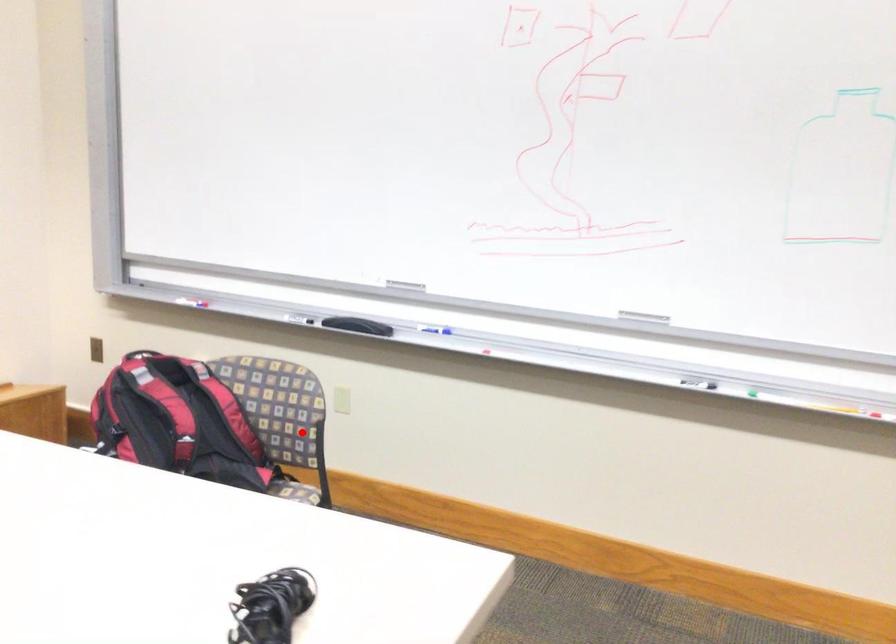
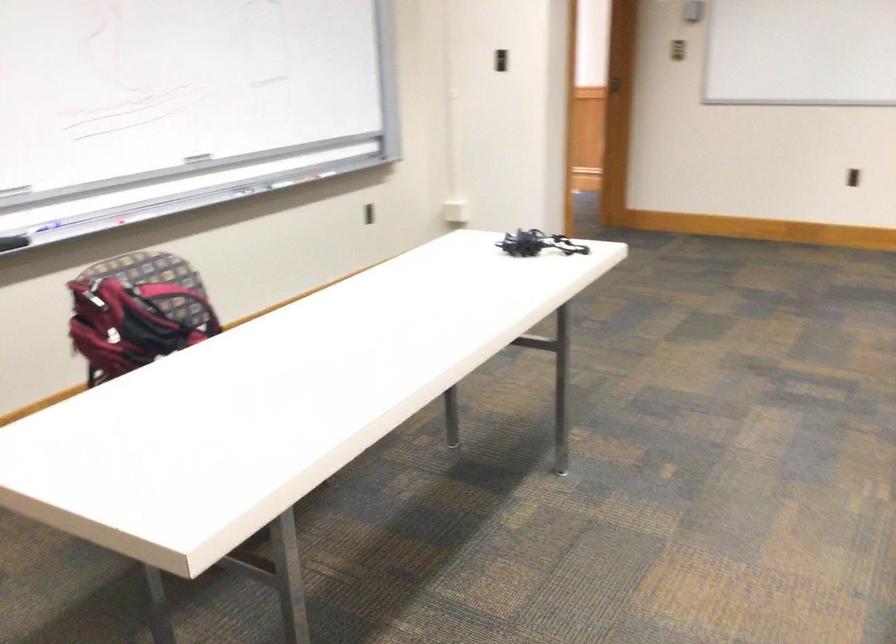
Question: I am providing you with two images of the same scene from different viewpoints. In image1, a red point is highlighted. Considering the same 3D point in image2, which of the following is correct?

Choices:
 (A) It is closer
 (B) It is farther

Answer: (B)